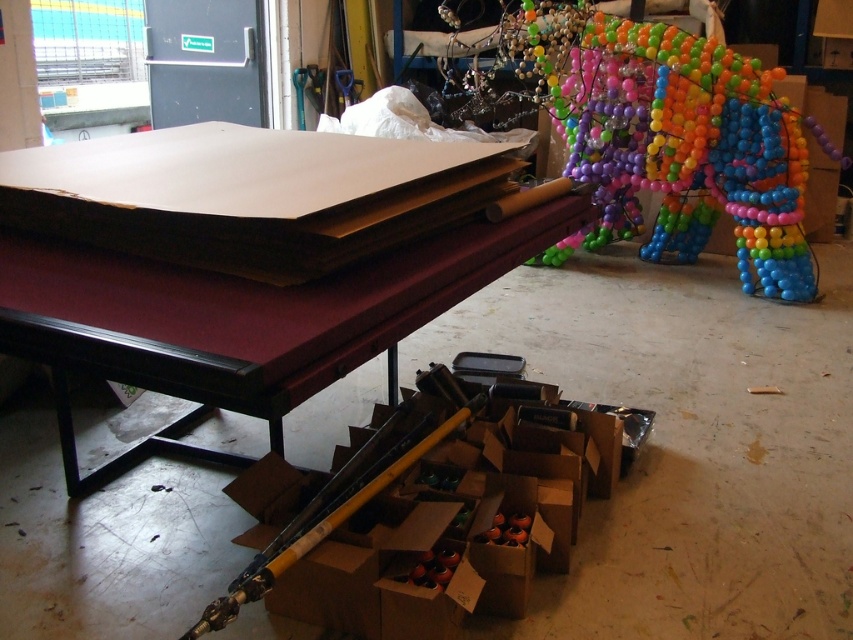
Is maroon felt pool table at center positioned at the back of multicolored plastic balloon at upper right?

No, maroon felt pool table at center is closer to the viewer.

Where is `maroon felt pool table at center`? This screenshot has height=640, width=853. maroon felt pool table at center is located at coordinates (241, 323).